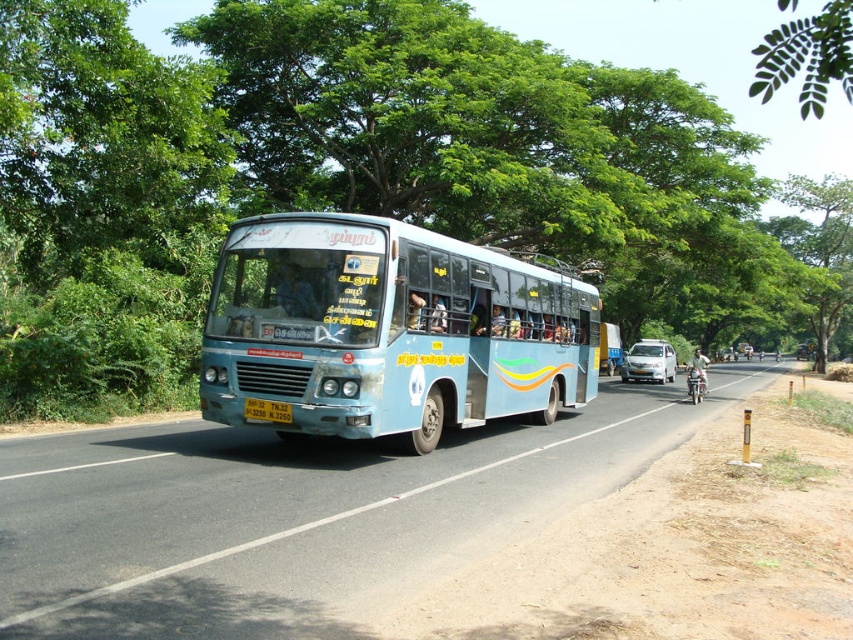
Question: Is green leafy tree at upper center closer to camera compared to yellow metallic license plate at center?

Choices:
 (A) yes
 (B) no

Answer: (A)

Question: Which object appears closest to the camera in this image?

Choices:
 (A) blue matte bus at center
 (B) green leafy tree at upper center
 (C) yellow metallic license plate at center

Answer: (B)

Question: Which point appears closest to the camera in this image?

Choices:
 (A) (703, 378)
 (B) (51, 109)

Answer: (B)

Question: Does yellow metallic license plate at center have a lesser width compared to metallic silver motorcycle at right?

Choices:
 (A) yes
 (B) no

Answer: (A)

Question: Which point appears farthest from the camera in this image?

Choices:
 (A) (267, 412)
 (B) (701, 368)
 (C) (374, 216)

Answer: (B)

Question: Is blue matte bus at center to the left of metallic silver motorcycle at right from the viewer's perspective?

Choices:
 (A) yes
 (B) no

Answer: (A)